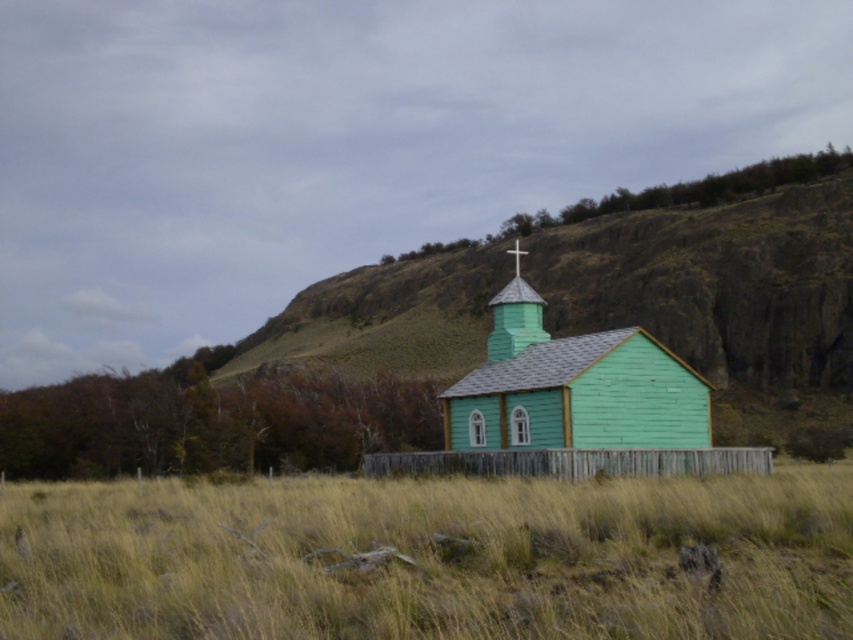
Question: Can you confirm if green grass at center is bigger than green wooden church at center?

Choices:
 (A) no
 (B) yes

Answer: (B)

Question: Among these objects, which one is nearest to the camera?

Choices:
 (A) green wooden church at center
 (B) green grass at center

Answer: (B)

Question: Among these objects, which one is nearest to the camera?

Choices:
 (A) green grass at center
 (B) green wooden church at center

Answer: (A)

Question: Can you confirm if green grass at center is positioned below green wooden church at center?

Choices:
 (A) no
 (B) yes

Answer: (B)

Question: Among these points, which one is nearest to the camera?

Choices:
 (A) (849, 493)
 (B) (491, 422)

Answer: (A)

Question: Is green grass at center further to the viewer compared to green wooden church at center?

Choices:
 (A) yes
 (B) no

Answer: (B)